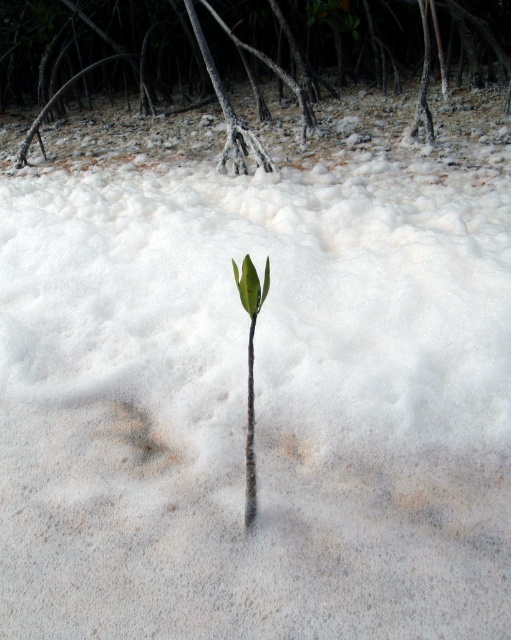
Who is positioned more to the right, brown rough mangrove root at center or green matte leaf at center?

From the viewer's perspective, green matte leaf at center appears more on the right side.

This screenshot has width=511, height=640. Describe the element at coordinates (246, 49) in the screenshot. I see `brown rough mangrove root at center` at that location.

Does point (361, 10) come closer to viewer compared to point (248, 416)?

No.

Where is `brown rough mangrove root at center`? The image size is (511, 640). brown rough mangrove root at center is located at coordinates (246, 49).